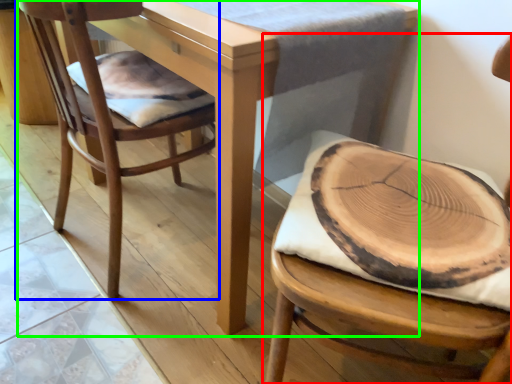
Question: Considering the real-world distances, which object is closest to chair (highlighted by a red box)? chair (highlighted by a blue box) or table (highlighted by a green box).

Choices:
 (A) chair
 (B) table

Answer: (B)